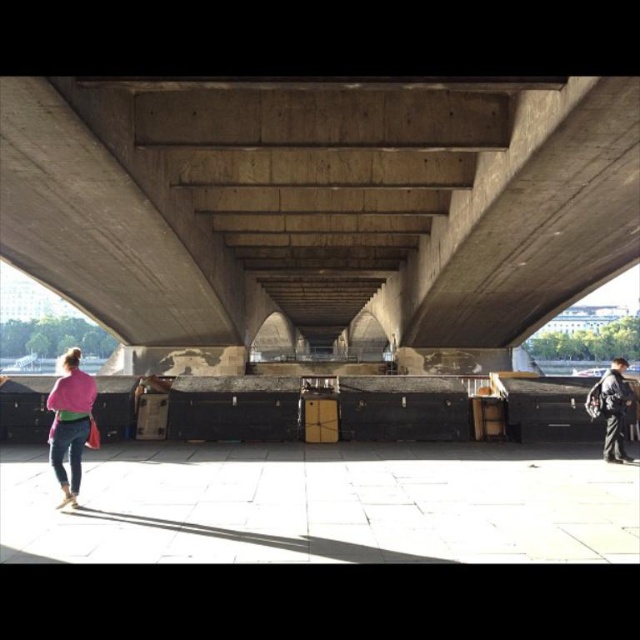
You are standing at the base of the bridge and notice the concrete at center and the pink fabric at left. Which object is closer to you?

The concrete at center is closer to you because the pink fabric at left is behind it.

You are a photographer trying to capture both the pink fabric at left and the dark gray fabric jacket at lower right in a single shot. Given their sizes, which object should you focus on to ensure both are clearly visible in the frame?

The pink fabric at left is larger in size than the dark gray fabric jacket at lower right, so focusing on the pink fabric at left will help ensure both are clearly visible in the frame.

In the scene shown: You are standing under the bridge and want to know which object takes up more space in the image. Which one is bigger between the concrete at center and the dark gray fabric jacket at lower right?

The concrete at center is larger in size than the dark gray fabric jacket at lower right, so the concrete at center takes up more space in the image.